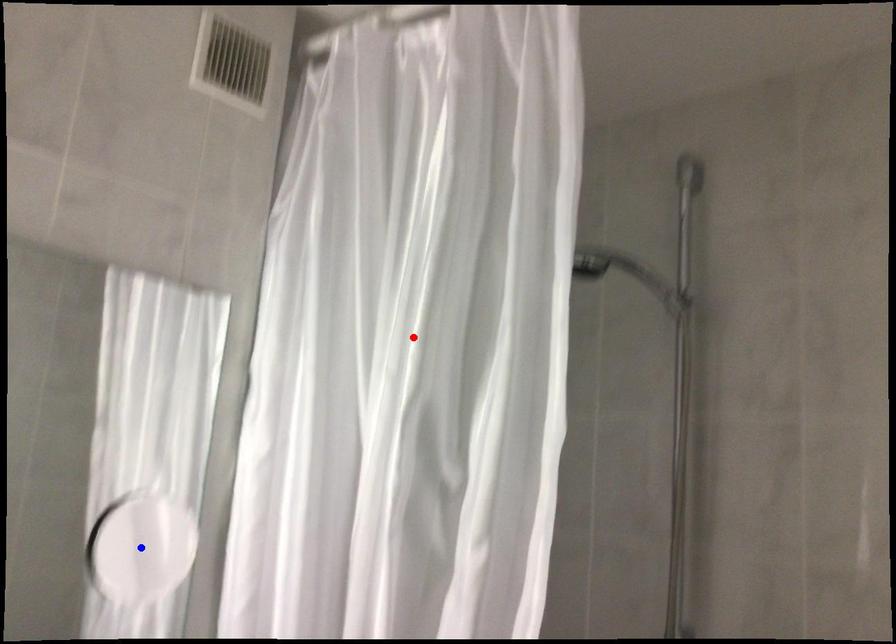
Question: Two points are marked on the image. Which point is closer to the camera?

Choices:
 (A) Blue point is closer.
 (B) Red point is closer.

Answer: (B)